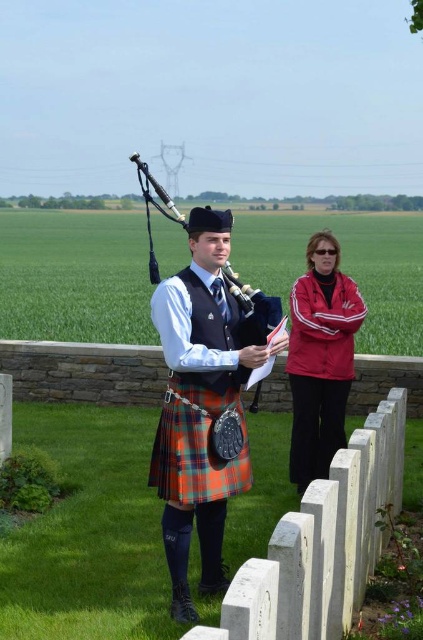
You are a photographer trying to capture a photo of the red fabric jacket at center and the polished wood bagpipe at center. Since you want both items to be clearly visible in the frame, can you determine which one you should focus on first?

The red fabric jacket at center is located below the polished wood bagpipe at center, so you should focus on the polished wood bagpipe at center first as it is higher up and might be in the foreground, ensuring both are in focus.

You are a photographer at the cemetery scene. You need to capture a photo where both the plaid wool kilt at center and the polished wood bagpipe at center are clearly visible. Based on their positions, which object should you ensure is in the lower part of the frame?

The plaid wool kilt at center is below the polished wood bagpipe at center, so to ensure both are visible, the plaid wool kilt at center should be placed in the lower part of the frame while the polished wood bagpipe at center is positioned higher up.